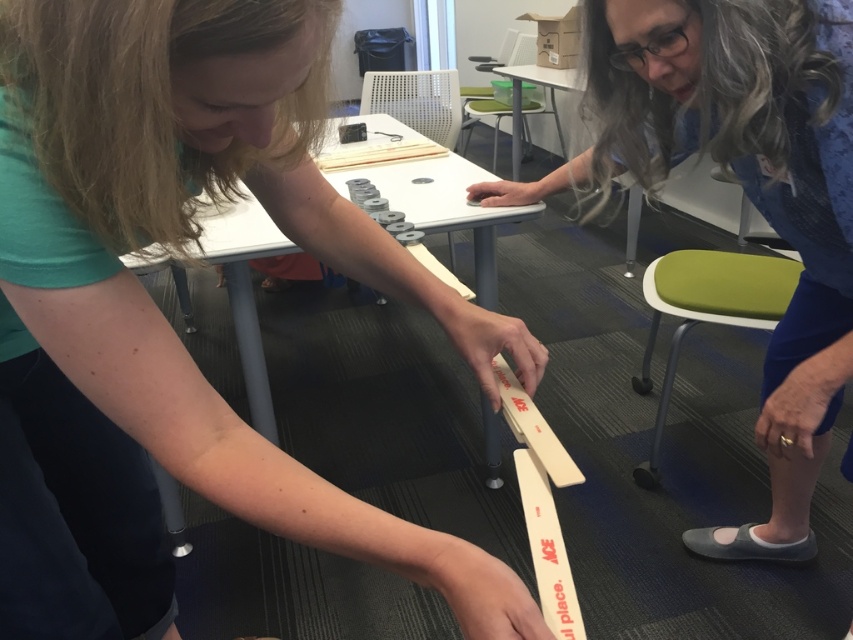
Question: Which of the following is the farthest from the observer?

Choices:
 (A) (143, 138)
 (B) (776, 100)

Answer: (B)

Question: Where is matte white ruler at lower center located in relation to wooden ruler at center in the image?

Choices:
 (A) left
 (B) right

Answer: (A)

Question: Which object appears closest to the camera in this image?

Choices:
 (A) wooden ruler at center
 (B) matte white ruler at lower center

Answer: (B)

Question: Does matte white ruler at lower center come in front of wooden ruler at center?

Choices:
 (A) no
 (B) yes

Answer: (B)

Question: Which point is closer to the camera taking this photo?

Choices:
 (A) (173, 177)
 (B) (793, 364)

Answer: (A)

Question: Does matte white ruler at lower center appear on the right side of wooden ruler at center?

Choices:
 (A) yes
 (B) no

Answer: (B)